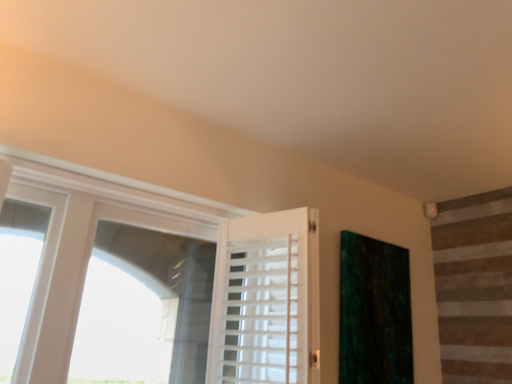
Question: Should I look upward or downward to see green velvet curtain at right?

Choices:
 (A) up
 (B) down

Answer: (B)

Question: From a real-world perspective, is green velvet curtain at right physically above white wood barn door at center?

Choices:
 (A) yes
 (B) no

Answer: (A)

Question: Can you confirm if green velvet curtain at right is wider than white wood barn door at center?

Choices:
 (A) yes
 (B) no

Answer: (B)

Question: Is green velvet curtain at right smaller than white wood barn door at center?

Choices:
 (A) yes
 (B) no

Answer: (A)

Question: Is green velvet curtain at right surrounding white wood barn door at center?

Choices:
 (A) yes
 (B) no

Answer: (B)

Question: Would you consider green velvet curtain at right to be distant from white wood barn door at center?

Choices:
 (A) no
 (B) yes

Answer: (A)

Question: Can you confirm if green velvet curtain at right is positioned to the right of white wood barn door at center?

Choices:
 (A) yes
 (B) no

Answer: (A)

Question: Is green velvet curtain at right at the back of white wood barn door at center?

Choices:
 (A) yes
 (B) no

Answer: (A)

Question: Can you confirm if white wood barn door at center is smaller than green velvet curtain at right?

Choices:
 (A) no
 (B) yes

Answer: (A)

Question: Considering the relative positions of white wood barn door at center and green velvet curtain at right in the image provided, is white wood barn door at center in front of green velvet curtain at right?

Choices:
 (A) no
 (B) yes

Answer: (B)

Question: Does white wood barn door at center have a lesser width compared to green velvet curtain at right?

Choices:
 (A) no
 (B) yes

Answer: (A)

Question: Does white wood barn door at center lie behind green velvet curtain at right?

Choices:
 (A) yes
 (B) no

Answer: (B)

Question: Is white wood barn door at center shorter than green velvet curtain at right?

Choices:
 (A) no
 (B) yes

Answer: (B)

Question: Considering the relative positions of green velvet curtain at right and white wood barn door at center in the image provided, is green velvet curtain at right to the left or to the right of white wood barn door at center?

Choices:
 (A) right
 (B) left

Answer: (A)